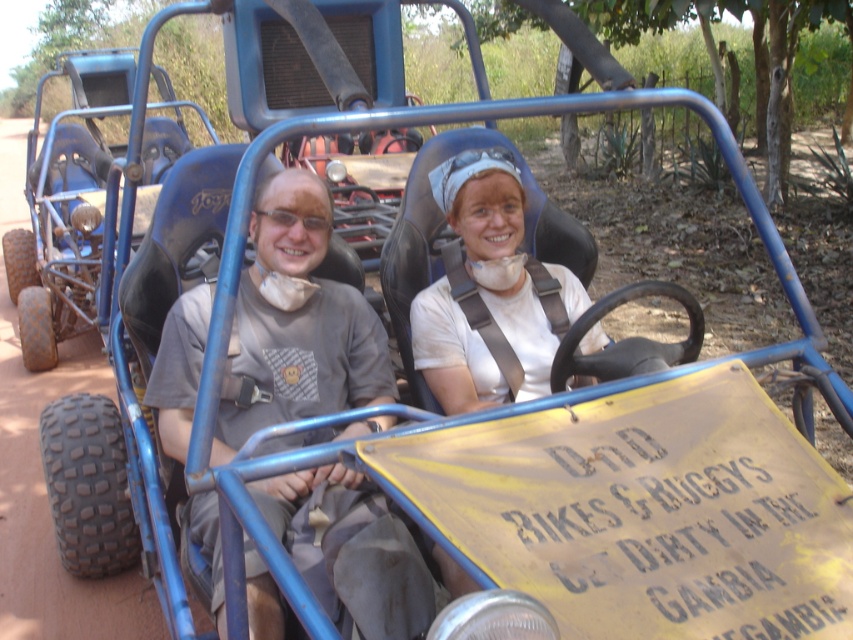
You are standing in front of the blue offroad buggy and want to determine which of the two points, point (x=328, y=228) or point (x=434, y=282), is closer to you. Based on the image, which point is nearer?

Point (x=328, y=228) is closer to the camera than point (x=434, y=282), so it is the nearer one.